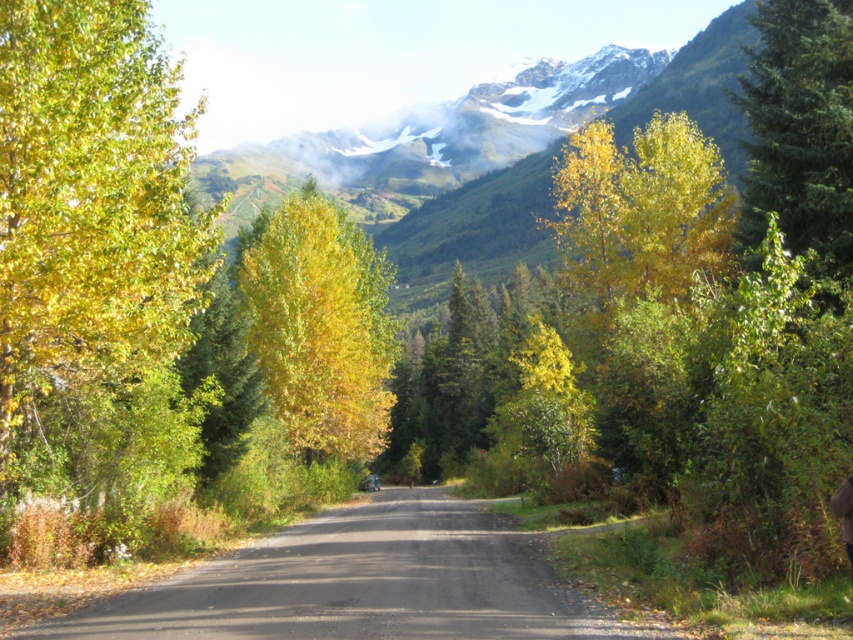
You are standing at the starting point of the road and see the point marked as point [801,134]. What is the color and type of the tree located at that point?

The tree at point [801,134] is a green evergreen tree.

You are a hiker carrying a brown leather jacket at center and want to take a photo of the green evergreen tree at right. Since you want the tree to look bigger in the photo, should you move closer to or farther away from the tree?

The green evergreen tree at right is already larger in size than the brown leather jacket at center. To make the tree appear even larger in the photo, you should move closer to the green evergreen tree at right.

You are driving a car that is 2 meters wide. You are on the asphalt road at center and see a yellow matte tree at center. Can your car fit between them without touching either?

The asphalt road at center is thinner than yellow matte tree at center, so the road is narrower than the tree. Since the car is 2 meters wide, it might not fit if the road is narrower than 2 meters. However, the description does not provide exact measurements, so we cannot confirm.